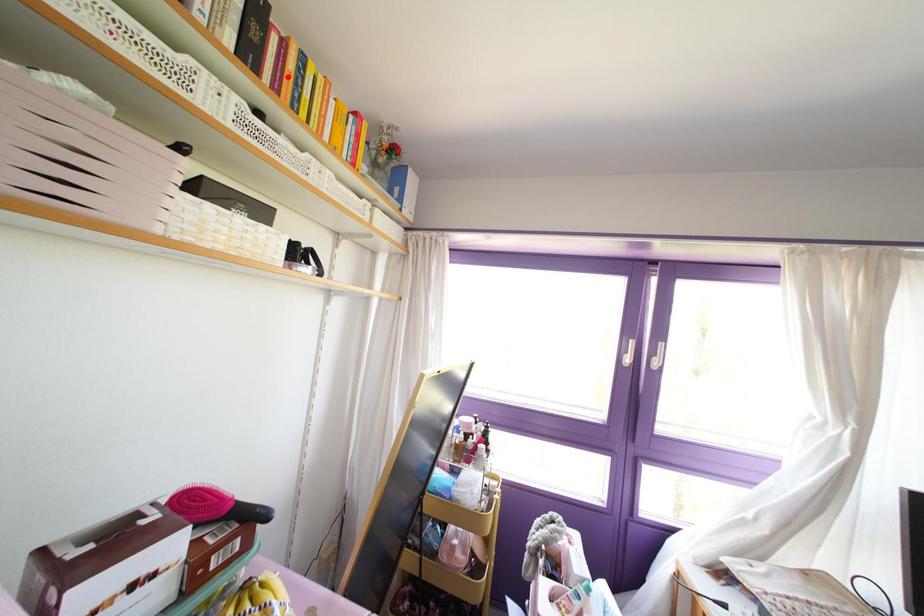
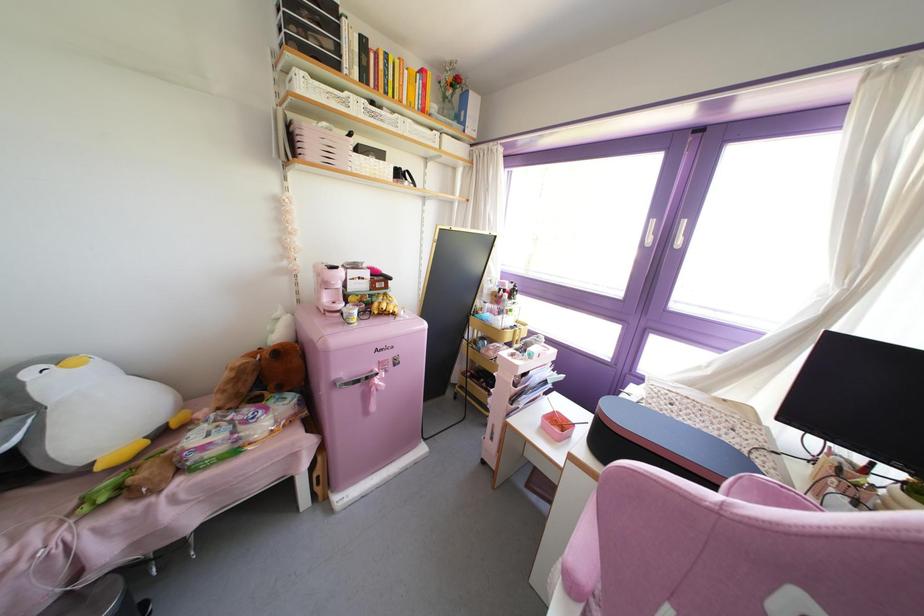
In the second image, find the point that corresponds to the highlighted location in the first image.

(381, 74)